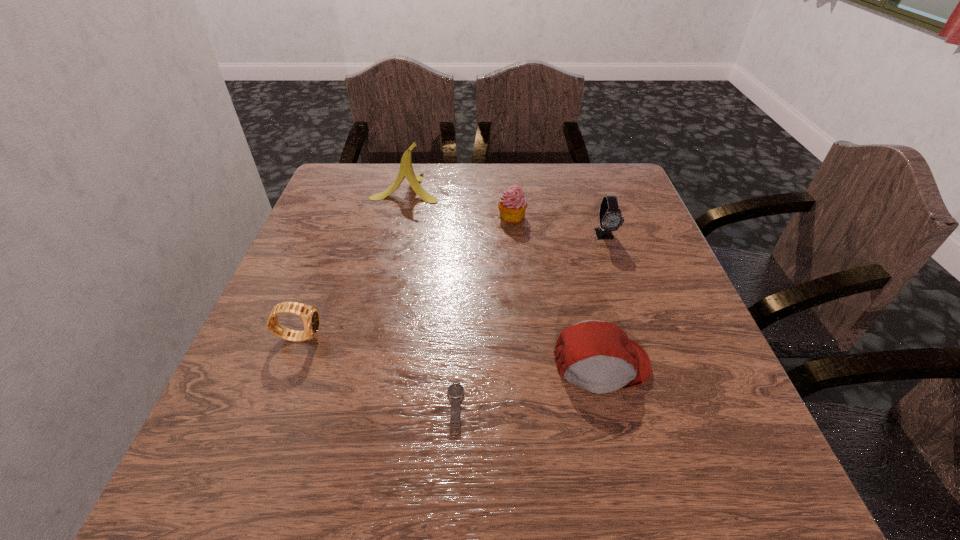
Find the location of a particular element. The image size is (960, 540). object that can be found as the third closest to the farthest watch is located at coordinates (406, 170).

This screenshot has height=540, width=960. In order to click on watch that stands as the second closest to the shortest watch in this screenshot , I will do `click(610, 217)`.

Where is `watch that is the third nearest to the banana`? watch that is the third nearest to the banana is located at coordinates (455, 391).

In order to click on vacant space that satisfies the following two spatial constraints: 1. on the back side of the shortest watch; 2. on the left side of the fourth object from left to right in this screenshot , I will do `click(464, 217)`.

This screenshot has width=960, height=540. I want to click on free space that satisfies the following two spatial constraints: 1. on the face of the shortest watch; 2. on the right side of the second farthest watch, so click(272, 410).

Locate an element on the screen. The height and width of the screenshot is (540, 960). free spot that satisfies the following two spatial constraints: 1. on the front side of the cupcake; 2. on the face of the second farthest watch is located at coordinates (522, 336).

In order to click on blank area in the image that satisfies the following two spatial constraints: 1. on the front side of the shortest object; 2. on the left side of the banana in this screenshot , I will do `click(355, 410)`.

Locate an element on the screen. free region that satisfies the following two spatial constraints: 1. on the face of the tallest watch; 2. on the face of the second nearest watch is located at coordinates (639, 336).